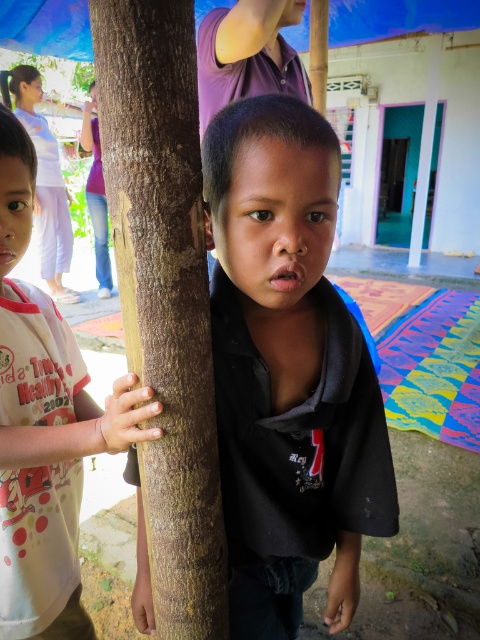
Does black matte shirt at center appear under purple smooth shirt at upper center?

Yes, black matte shirt at center is below purple smooth shirt at upper center.

Between black matte shirt at center and purple smooth shirt at upper center, which one appears on the left side from the viewer's perspective?

Positioned to the left is black matte shirt at center.

Which is in front, point (265, 332) or point (287, 58)?

Point (265, 332) is in front.

Locate an element on the screen. black matte shirt at center is located at coordinates (288, 371).

Does black matte shirt at center have a lesser height compared to light pink fabric shirt at left?

Correct, black matte shirt at center is not as tall as light pink fabric shirt at left.

Consider the image. Does black matte shirt at center have a greater width compared to light pink fabric shirt at left?

Correct, the width of black matte shirt at center exceeds that of light pink fabric shirt at left.

Is point (232, 388) more distant than point (67, 544)?

That is False.

The height and width of the screenshot is (640, 480). Find the location of `black matte shirt at center`. black matte shirt at center is located at coordinates (288, 371).

Who is more distant from viewer, (176, 508) or (216, 28)?

Point (216, 28)

This screenshot has height=640, width=480. Describe the element at coordinates (165, 294) in the screenshot. I see `brown rough tree trunk at center` at that location.

Identify the location of brown rough tree trunk at center. point(165,294).